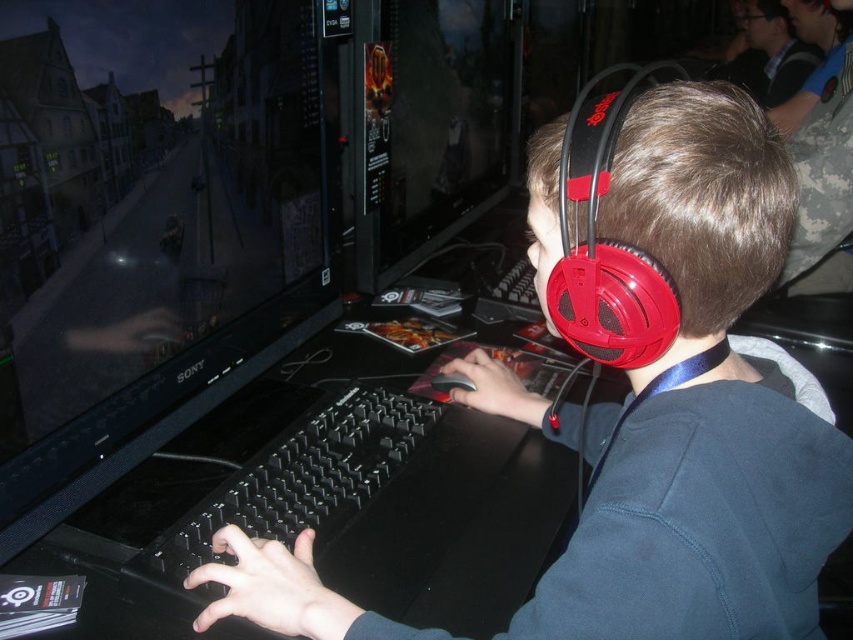
Question: Is matte black monitor at upper left bigger than matte black monitor at center?

Choices:
 (A) yes
 (B) no

Answer: (B)

Question: Does red matte headphones at center appear over matte black monitor at center?

Choices:
 (A) no
 (B) yes

Answer: (A)

Question: Among these points, which one is farthest from the camera?

Choices:
 (A) (596, 506)
 (B) (245, 269)

Answer: (B)

Question: From the image, what is the correct spatial relationship of matte black monitor at upper left in relation to matte black monitor at center?

Choices:
 (A) left
 (B) right

Answer: (A)

Question: Which point is closer to the camera taking this photo?

Choices:
 (A) (329, 616)
 (B) (402, 152)

Answer: (A)

Question: Which object appears farthest from the camera in this image?

Choices:
 (A) matte black monitor at center
 (B) matte black monitor at upper left

Answer: (A)